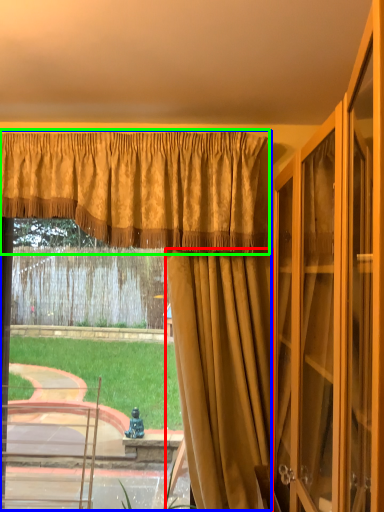
Question: Which object is positioned farthest from curtain (highlighted by a red box)? Select from curtain (highlighted by a blue box) and curtain (highlighted by a green box).

Choices:
 (A) curtain
 (B) curtain

Answer: (B)